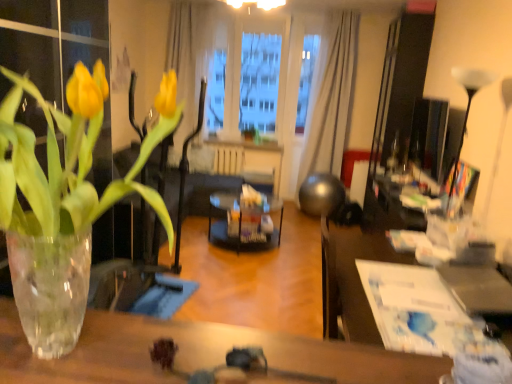
Image resolution: width=512 pixels, height=384 pixels. I want to click on vacant space situated above white paper at center, positioned as the 1th table in back-to-front order (from a real-world perspective), so click(x=418, y=305).